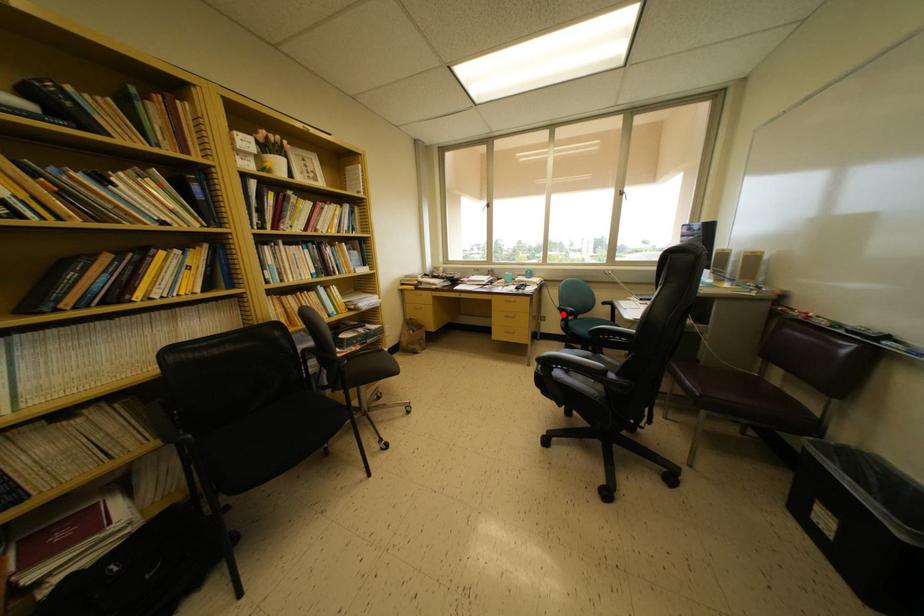
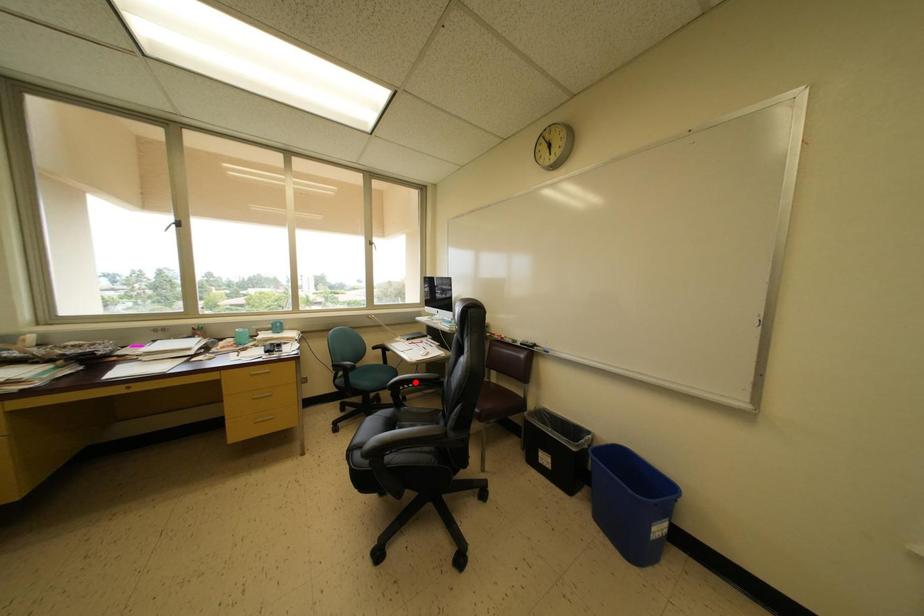
I am providing you with two images of the same scene from different viewpoints. A red point is marked on the first image and another point is marked on the second image. Do the highlighted points in image1 and image2 indicate the same real-world spot?

No